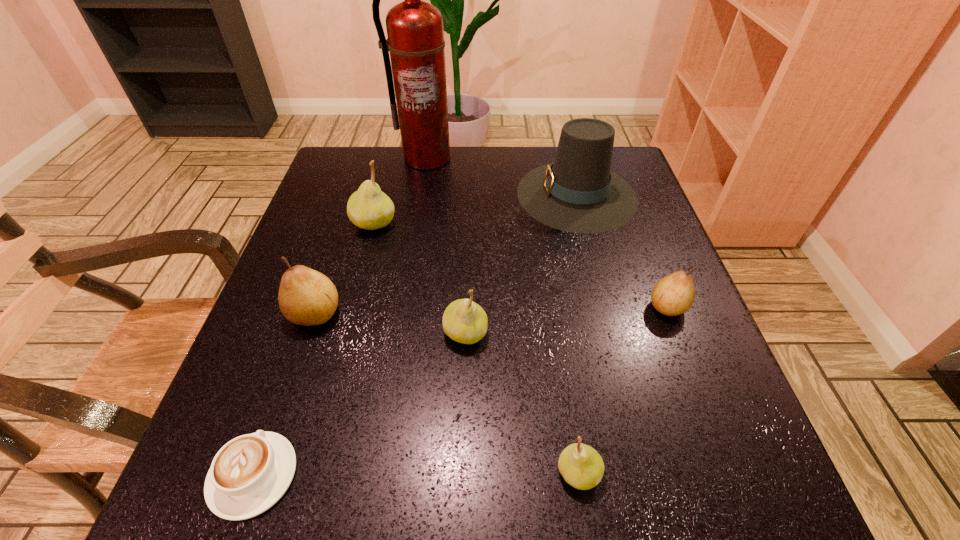
Locate an element on the screen. Image resolution: width=960 pixels, height=540 pixels. free space located on the front of the smaller brown pear is located at coordinates (687, 359).

Locate an element on the screen. This screenshot has height=540, width=960. free space located 0.380m on the back of the smallest green pear is located at coordinates (548, 268).

Where is `free space located with the handle on the right side of the shortest object`? This screenshot has height=540, width=960. free space located with the handle on the right side of the shortest object is located at coordinates (326, 262).

Locate an element on the screen. Image resolution: width=960 pixels, height=540 pixels. blank space located with the handle on the right side of the shortest object is located at coordinates (307, 319).

Identify the location of vacant space located 0.380m with the handle on the right side of the shortest object. (328, 259).

You are a GUI agent. You are given a task and a screenshot of the screen. Output one action in this format:
    pyautogui.click(x=<x>, y=<y>)
    Task: Click on the fire extinguisher present at the far edge
    Image resolution: width=960 pixels, height=540 pixels.
    Given the screenshot: What is the action you would take?
    pyautogui.click(x=415, y=32)

Identify the location of hat that is positioned at the far edge. The image size is (960, 540). (578, 193).

Locate an element on the screen. Image resolution: width=960 pixels, height=540 pixels. pear located in the near edge section of the desktop is located at coordinates (581, 466).

Identify the location of cappuccino present at the near edge. Image resolution: width=960 pixels, height=540 pixels. (249, 474).

Locate an element on the screen. cappuccino situated at the left edge is located at coordinates (249, 474).